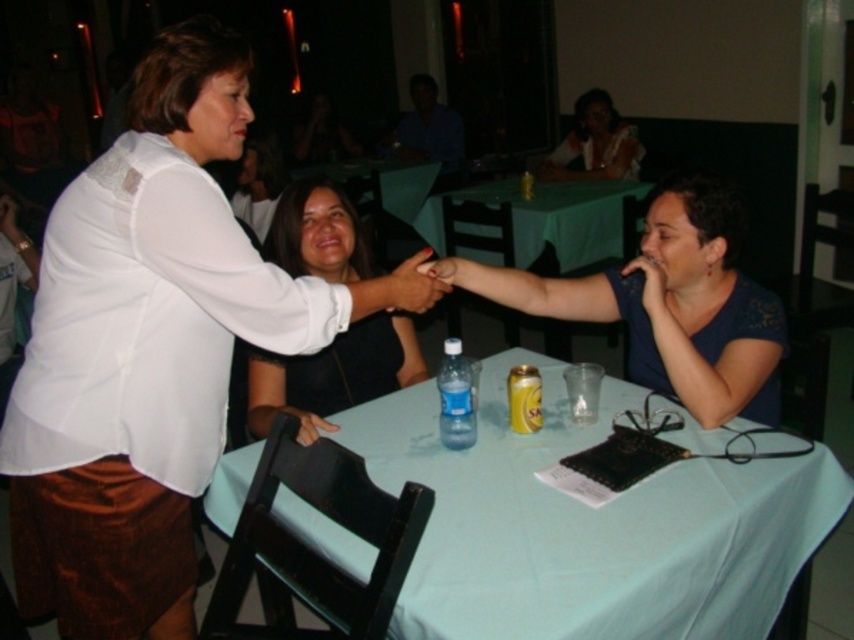
You are at the restaurant and want to place a dessert plate on the light blue fabric table at center. Where exactly should you place it?

You should place the dessert plate at point coordinates [588,525] on the light blue fabric table at center.

You are a photographer at the event and want to capture a photo that includes both the light blue fabric table at center and the blue shirt at upper center. Based on their positions, which object should be placed closer to the bottom of the photo frame?

The light blue fabric table at center is located below the blue shirt at upper center, so to include both in the photo frame, the light blue fabric table at center should be placed closer to the bottom of the photo frame.

You are standing at point (430, 108) and want to walk to point (571, 586). Is the path directly in front of you clear?

Yes, the path is clear because point (571, 586) is in front of point (430, 108).